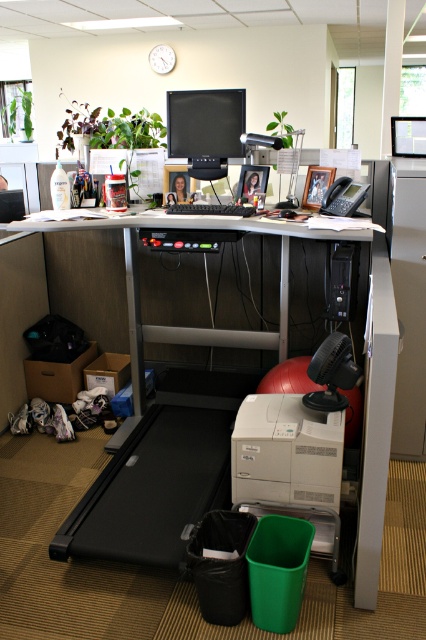
Based on the photo, you are setting up a new monitor and keyboard on your desk. The existing setup has the matte black monitor at upper center and the black plastic keyboard at center. Which object should you place first if you want to ensure there is enough space for both items based on their sizes?

The matte black monitor at upper center is larger in size than the black plastic keyboard at center, so you should place the matte black monitor at upper center first to ensure there is enough space for both items.

You are organizing your office and need to move the white plastic file cabinet at right closer to the desk. However, there is a matte gray printer at lower center in the way. Can you move the printer out of the way to make space?

The matte gray printer at lower center is closer to the viewer than the white plastic file cabinet at right, so you can move the matte gray printer at lower center out of the way to make space for moving the white plastic file cabinet at right closer to the desk.

You are setting up a new webcam for a video call. The webcam needs to be placed to the right of the black plastic keyboard at center. Can you place it there without moving the matte black monitor at upper center?

The matte black monitor at upper center is to the left of the black plastic keyboard at center, so placing the webcam to the right of the black plastic keyboard at center is possible without moving the matte black monitor at upper center.